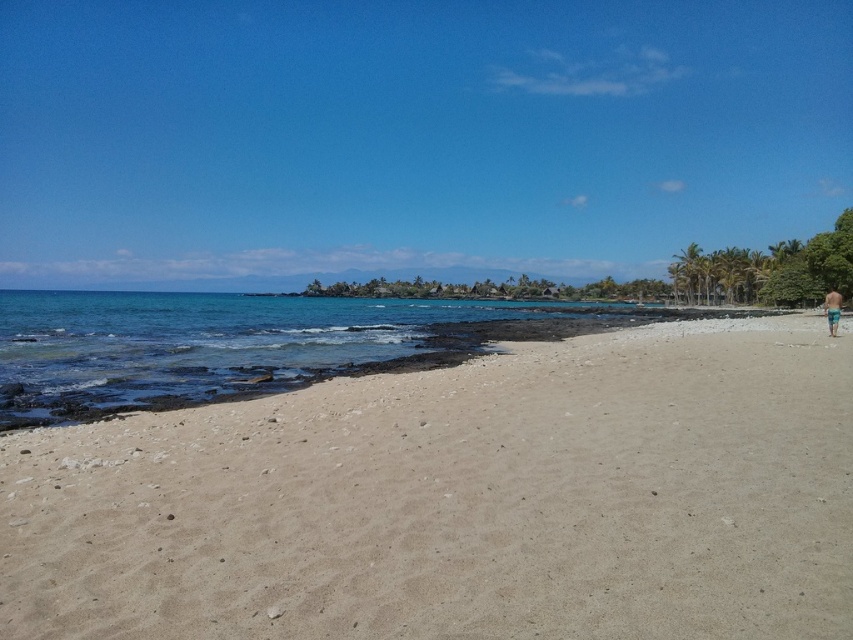
Question: Is clear blue water at lower left closer to the viewer compared to blue-green striped shorts at right?

Choices:
 (A) yes
 (B) no

Answer: (A)

Question: Observing the image, what is the correct spatial positioning of light beige sand at center in reference to blue-green striped shorts at right?

Choices:
 (A) below
 (B) above

Answer: (A)

Question: Does clear blue water at lower left have a greater width compared to blue-green striped shorts at right?

Choices:
 (A) yes
 (B) no

Answer: (A)

Question: Which object is positioned farthest from the light beige sand at center?

Choices:
 (A) clear blue water at lower left
 (B) blue-green striped shorts at right

Answer: (A)

Question: Which point is farther to the camera?

Choices:
 (A) (646, 509)
 (B) (144, 336)

Answer: (B)

Question: Which point appears farthest from the camera in this image?

Choices:
 (A) (598, 320)
 (B) (830, 333)
 (C) (772, 604)

Answer: (A)